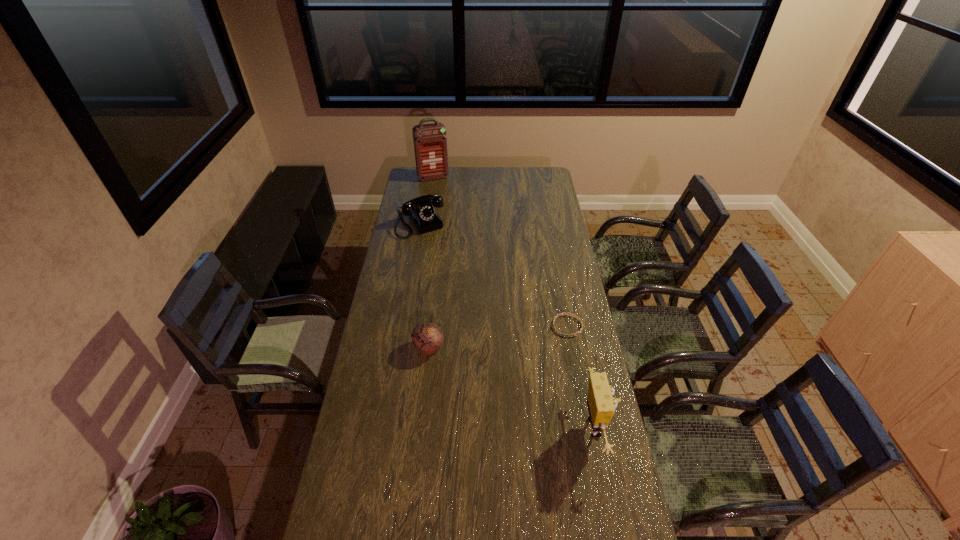
You are a GUI agent. You are given a task and a screenshot of the screen. Output one action in this format:
    pyautogui.click(x=<x>, y=<y>)
    Task: Click on the muffin
    This screenshot has height=540, width=960.
    Given the screenshot: What is the action you would take?
    pyautogui.click(x=428, y=337)

Identify the location of the nearest object. (601, 403).

You are a GUI agent. You are given a task and a screenshot of the screen. Output one action in this format:
    pyautogui.click(x=<x>, y=<y>)
    Task: Click on the second tallest object
    
    Given the screenshot: What is the action you would take?
    pyautogui.click(x=601, y=403)

Image resolution: width=960 pixels, height=540 pixels. I want to click on the fourth nearest object, so click(420, 210).

Identify the location of the third tallest object. Image resolution: width=960 pixels, height=540 pixels. (420, 210).

Where is `the farthest object`? the farthest object is located at coordinates (430, 142).

What are the coordinates of `the tallest object` in the screenshot? It's located at (430, 142).

I want to click on the shortest object, so click(x=577, y=317).

You are a GUI agent. You are given a task and a screenshot of the screen. Output one action in this format:
    pyautogui.click(x=<x>, y=<y>)
    Task: Click on the vacant space located on the left of the fourth tallest object
    This screenshot has height=540, width=960.
    Given the screenshot: What is the action you would take?
    pyautogui.click(x=388, y=347)

This screenshot has height=540, width=960. What are the coordinates of `vacant space located on the dial of the third shortest object` in the screenshot? It's located at (440, 255).